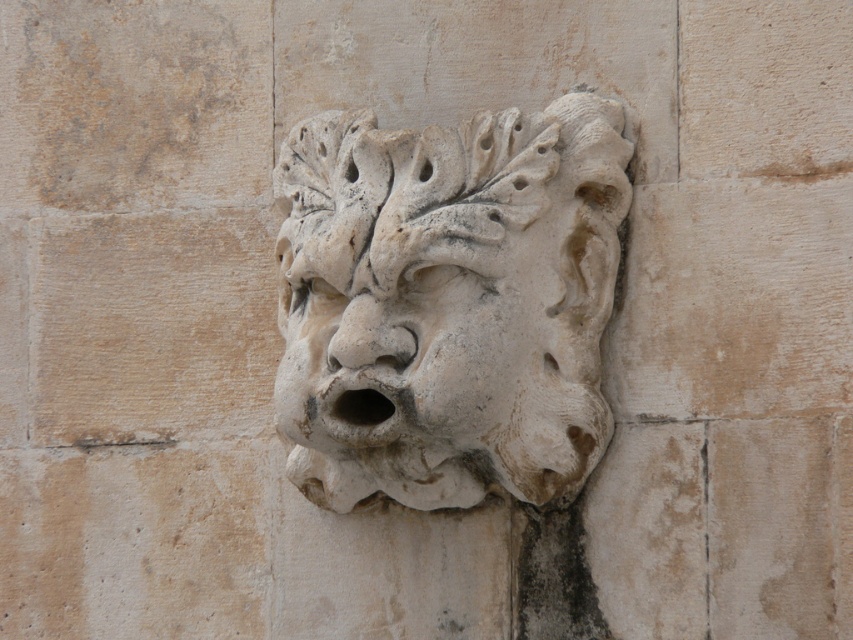
Find the location of `white stone lion at center`. white stone lion at center is located at coordinates (448, 301).

Which is more to the right, white stone lion at center or white stone face at center?

Positioned to the right is white stone lion at center.

Which is behind, point (563, 492) or point (402, 356)?

The point (563, 492) is more distant.

Find the location of a particular element. The width and height of the screenshot is (853, 640). white stone lion at center is located at coordinates (448, 301).